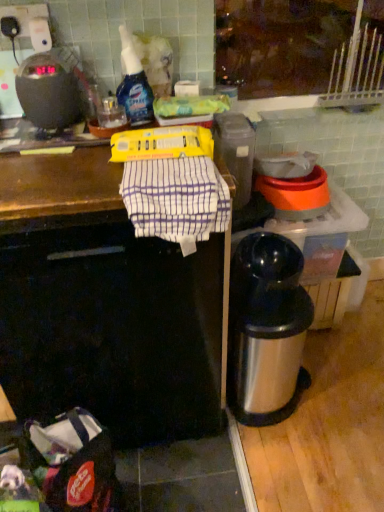
Identify the location of free space in front of silver metallic thermos at lower right. The height and width of the screenshot is (512, 384). (282, 462).